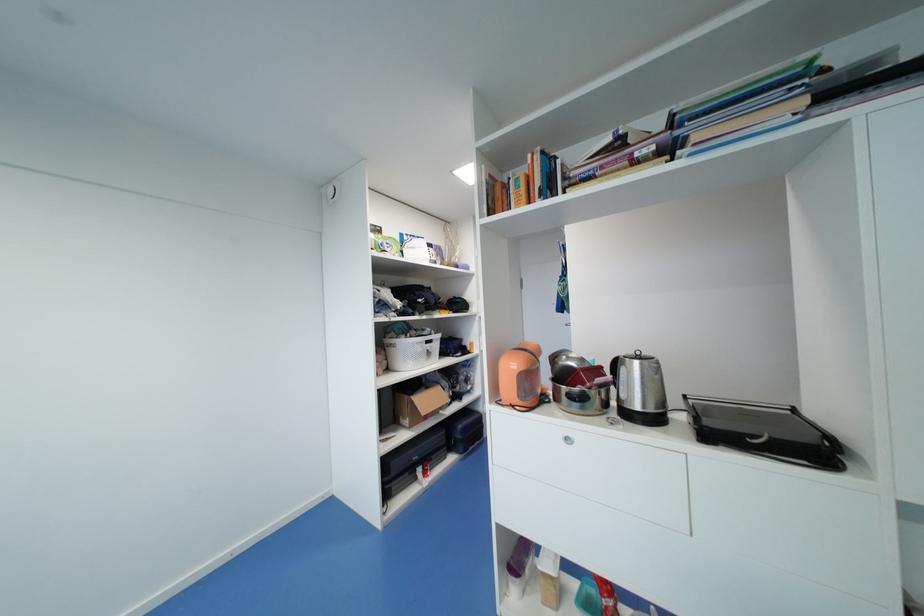
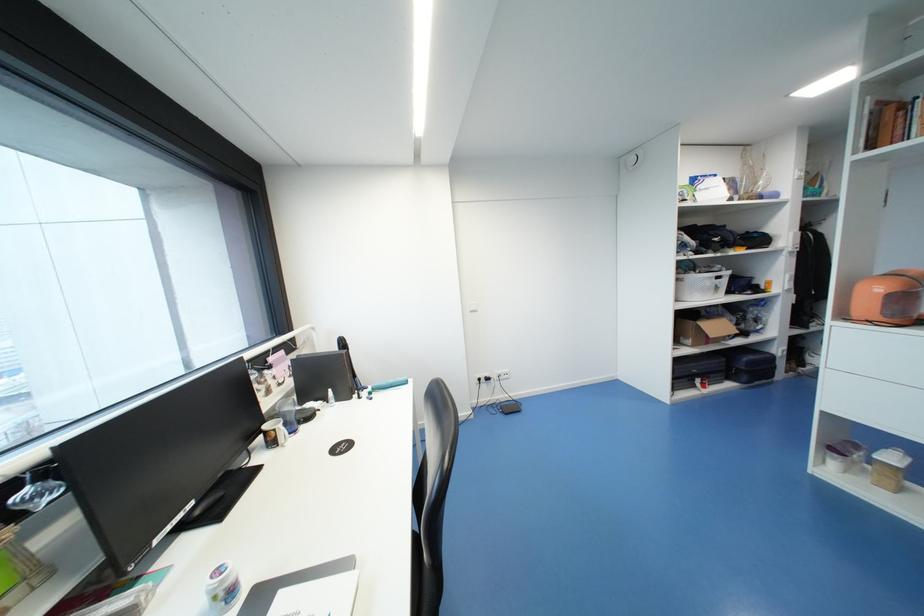
In the second image, find the point that corresponds to [455,451] in the first image.

(733, 379)